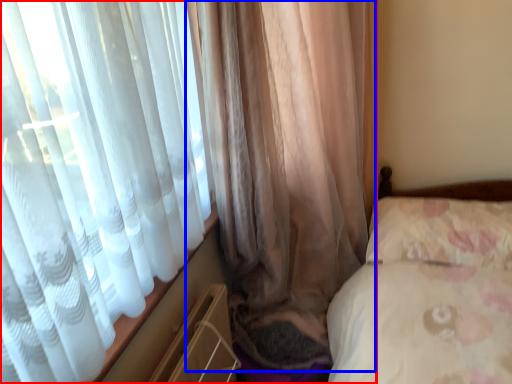
Question: Which of the following is the farthest to the observer, curtain (highlighted by a red box) or curtain (highlighted by a blue box)?

Choices:
 (A) curtain
 (B) curtain

Answer: (B)